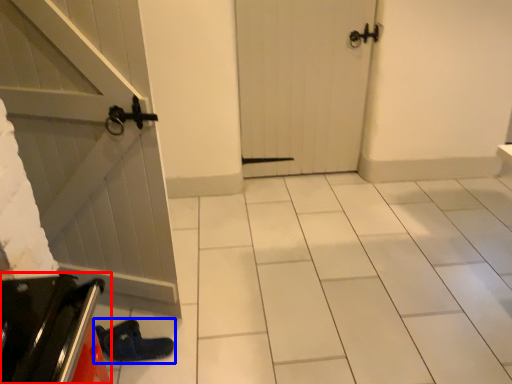
Question: Which object appears closest to the camera in this image, appliance (highlighted by a red box) or footwear (highlighted by a blue box)?

Choices:
 (A) appliance
 (B) footwear

Answer: (A)